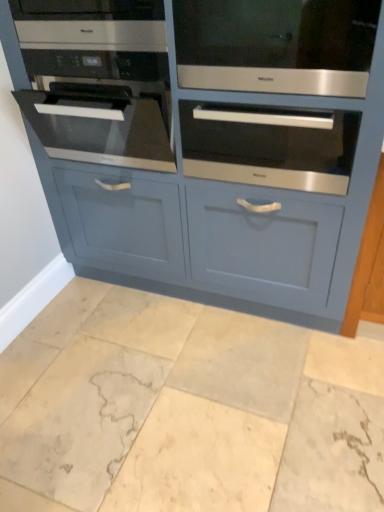
Question: Considering the positions of satin silver oven at center, which appears as the third oven when viewed from the left, and marble tile at lower center in the image, is satin silver oven at center, which appears as the third oven when viewed from the left, taller or shorter than marble tile at lower center?

Choices:
 (A) short
 (B) tall

Answer: (B)

Question: From the image's perspective, relative to marble tile at lower center, is satin silver oven at center, the 1th oven from the right, above or below?

Choices:
 (A) above
 (B) below

Answer: (A)

Question: Considering the real-world distances, which object is farthest from the satin stainless steel oven at upper left?

Choices:
 (A) satin black oven at left, placed as the first oven when sorted from left to right
 (B) satin silver oven at upper center, which appears as the second oven when viewed from the right
 (C) matte blue cabinet at center
 (D) satin silver oven at center, the 1th oven from the right
 (E) marble tile at lower center

Answer: (E)

Question: Which object is the farthest from the matte blue cabinet at center?

Choices:
 (A) satin silver oven at center, which appears as the third oven when viewed from the left
 (B) satin silver oven at upper center, which is the 2th oven in left-to-right order
 (C) marble tile at lower center
 (D) satin stainless steel oven at upper left
 (E) satin black oven at left, placed as the first oven when sorted from left to right

Answer: (C)